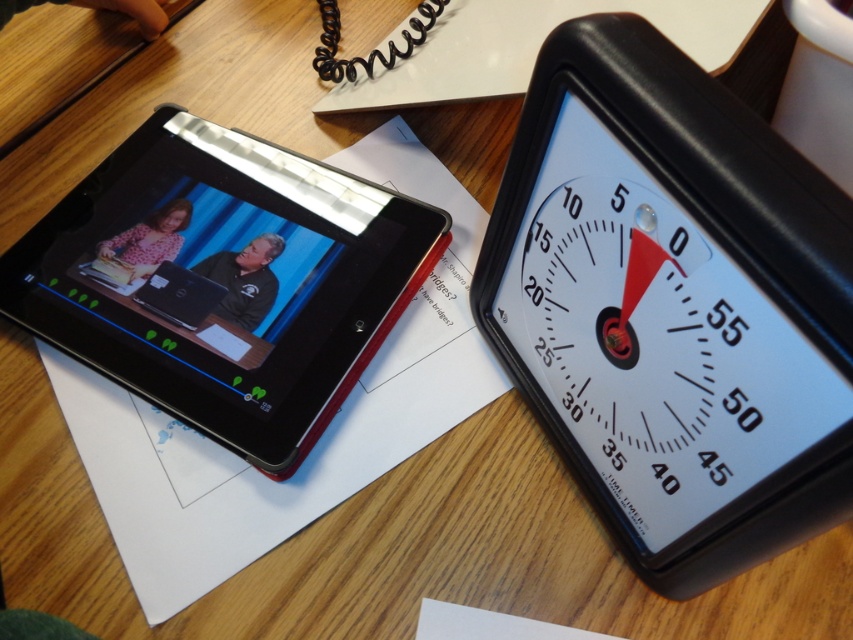
Consider the image. You are organizing items on a desk and need to place a new item between the white plastic timer at upper right and the black plastic tablet at left. Given their sizes, which item should you place closer to the edge of the desk to ensure there is enough space?

The white plastic timer at upper right is much taller than the black plastic tablet at left, so placing the taller timer closer to the edge of the desk would leave more space in the center for the new item.

You are organizing items on your desk and need to place a new item between the white plastic timer at upper right and the black plastic tablet at left. Given their sizes, which item should you place closer to the center of the desk?

Since the white plastic timer at upper right is narrower than the black plastic tablet at left, you should place the timer closer to the center of the desk to balance the space between them.